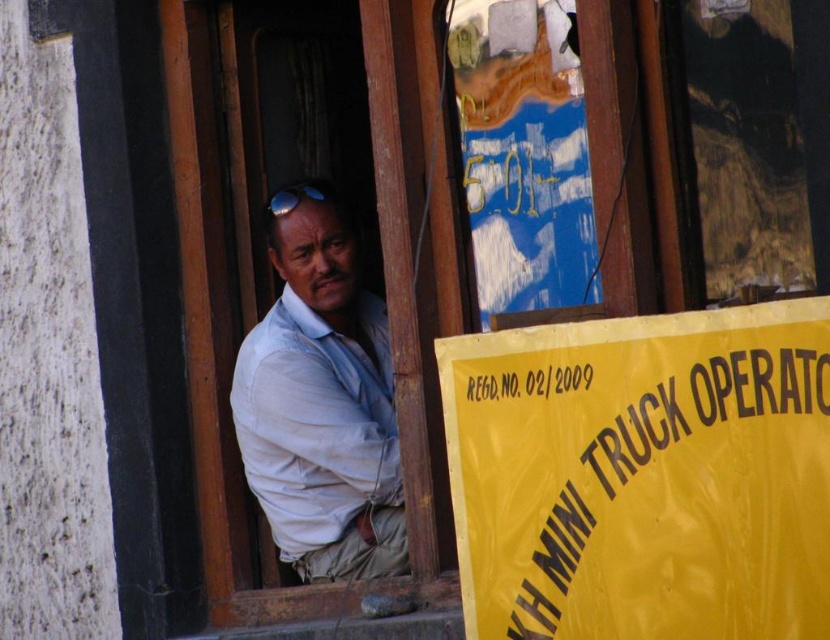
Question: Which point is closer to the camera taking this photo?

Choices:
 (A) (311, 193)
 (B) (321, 356)

Answer: (B)

Question: Is yellow paper sign at lower right to the left of blue reflective lens at upper center from the viewer's perspective?

Choices:
 (A) yes
 (B) no

Answer: (B)

Question: Can you confirm if yellow paper sign at lower right is wider than light blue shirt at center?

Choices:
 (A) no
 (B) yes

Answer: (B)

Question: Can you confirm if yellow paper sign at lower right is smaller than blue reflective lens at upper center?

Choices:
 (A) no
 (B) yes

Answer: (A)

Question: Which point is closer to the camera taking this photo?

Choices:
 (A) (706, 445)
 (B) (391, 480)

Answer: (A)

Question: Which of the following is the farthest from the observer?

Choices:
 (A) click(388, 396)
 (B) click(311, 184)
 (C) click(785, 419)

Answer: (A)